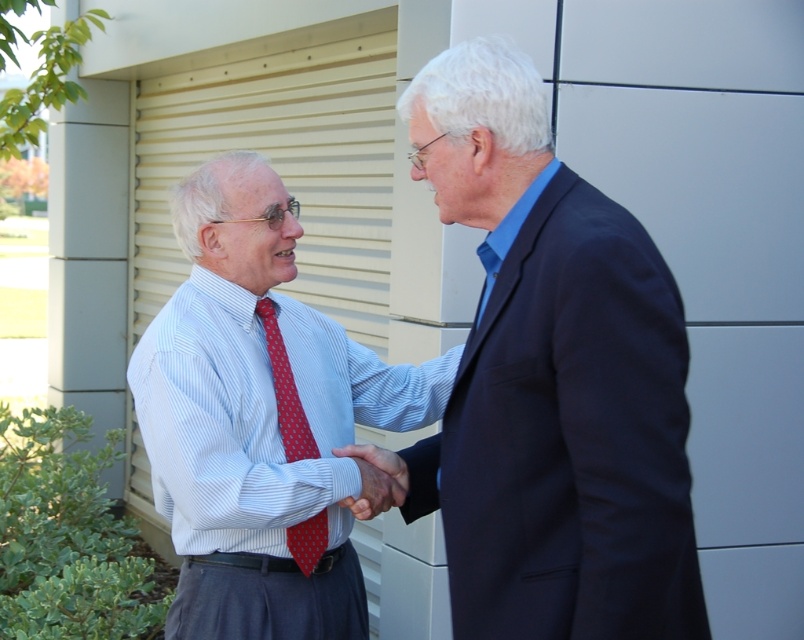
Question: Does blue fabric suit at center appear on the right side of striped cotton shirt at center?

Choices:
 (A) no
 (B) yes

Answer: (B)

Question: Which point is farther from the camera taking this photo?

Choices:
 (A) (532, 188)
 (B) (370, 504)
 (C) (232, 269)

Answer: (C)

Question: Is striped cotton shirt at center in front of matte red tie at center?

Choices:
 (A) no
 (B) yes

Answer: (B)

Question: Which is nearer to the red dotted tie at center?

Choices:
 (A) striped cotton shirt at center
 (B) blue fabric suit at center
 (C) matte red tie at center

Answer: (C)

Question: From the image, what is the correct spatial relationship of striped cotton shirt at center in relation to matte red tie at center?

Choices:
 (A) right
 (B) left

Answer: (B)

Question: Estimate the real-world distances between objects in this image. Which object is closer to the blue fabric suit at center?

Choices:
 (A) red dotted tie at center
 (B) striped cotton shirt at center
 (C) matte red tie at center

Answer: (C)